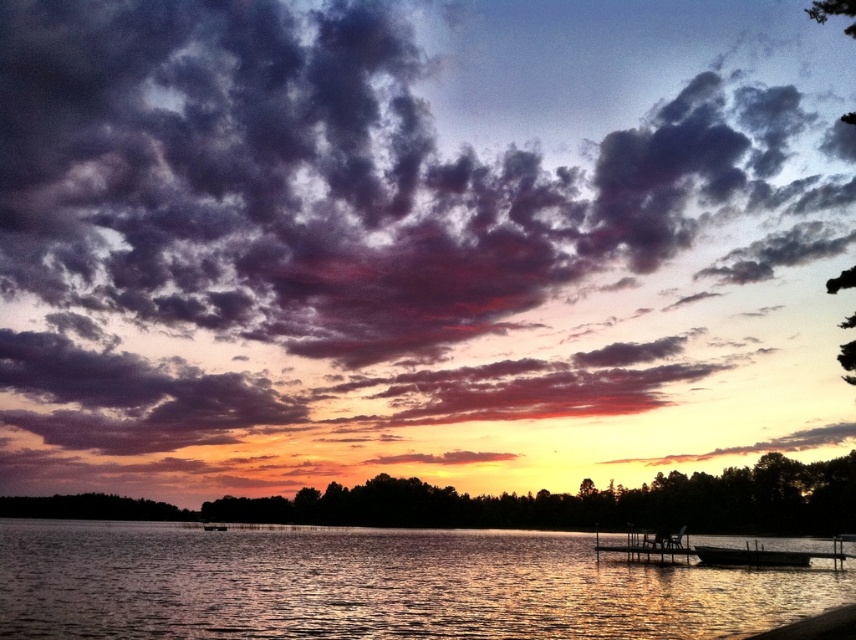
You are standing at the edge of the lake and want to take a photo of the glistening water at center and the wooden park bench at lower right. Which object will appear larger in your photo?

The glistening water at center will appear larger in the photo because it is closer to the viewer than the wooden park bench at lower right.

Consider the image. You are an artist setting up your easel to paint the lakeside scene. You want to ensure the wooden park bench at lower right is visible in your painting. Since the glistening water at center is so prominent, will the bench be obscured by it?

The glistening water at center has a larger size compared to wooden park bench at lower right, so the bench might be partially obscured but still visible as it is smaller and positioned at the lower right of the scene.

You are standing at the edge of the lake and notice a point marked at coordinates (x=375, y=584). Based on the scene description, what feature does this point most likely represent?

The point at (x=375, y=584) marks glistening water at center.